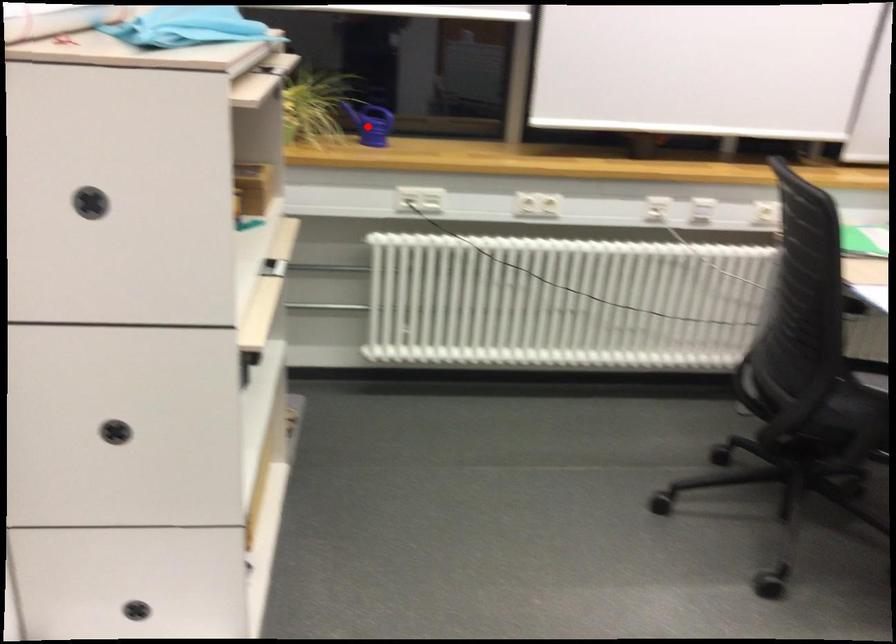
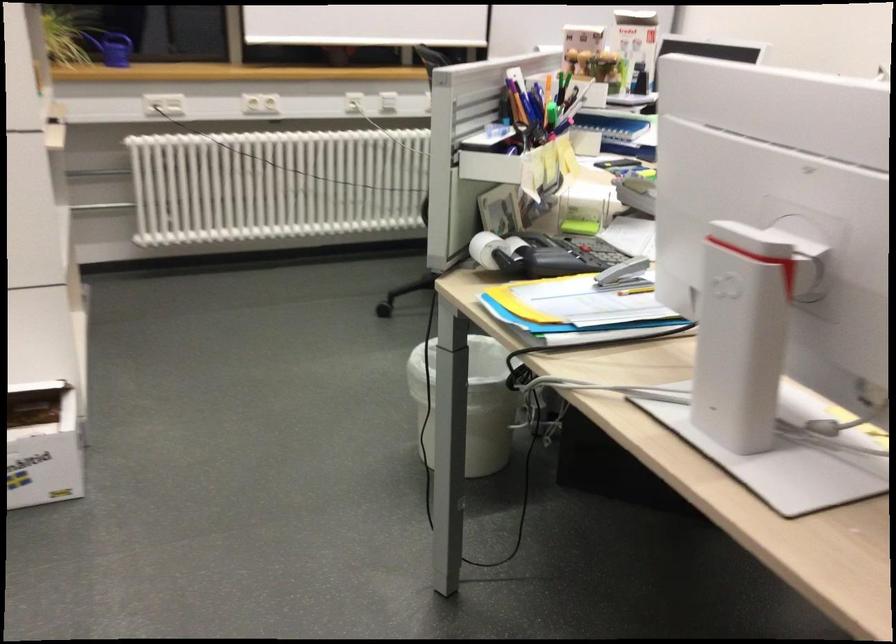
Question: I am providing you with two images of the same scene from different viewpoints. A red point is shown in image1. For the corresponding object point in image2, is it positioned nearer or farther from the camera?

Choices:
 (A) Nearer
 (B) Farther

Answer: (B)